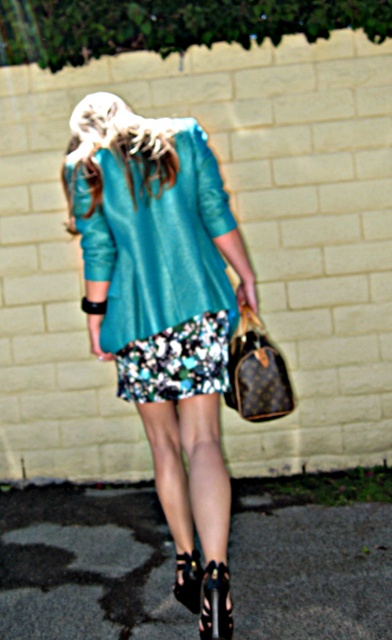
Question: Which of the following is the closest to the observer?

Choices:
 (A) (114, 180)
 (B) (245, 406)

Answer: (A)

Question: Does brown leather handbag at lower center appear under black leather sandal at lower center?

Choices:
 (A) no
 (B) yes

Answer: (A)

Question: Does black asphalt pavement at lower center have a lesser width compared to shiny black sandal at lower center?

Choices:
 (A) yes
 (B) no

Answer: (B)

Question: Which object appears farthest from the camera in this image?

Choices:
 (A) matte teal blouse at center
 (B) black leather sandal at lower center
 (C) blonde silky hair at upper center

Answer: (A)

Question: Does teal leather jacket at center have a smaller size compared to brown leather handbag at lower center?

Choices:
 (A) yes
 (B) no

Answer: (B)

Question: Which of the following is the closest to the observer?

Choices:
 (A) brown leather handbag at lower center
 (B) matte teal blouse at center

Answer: (B)